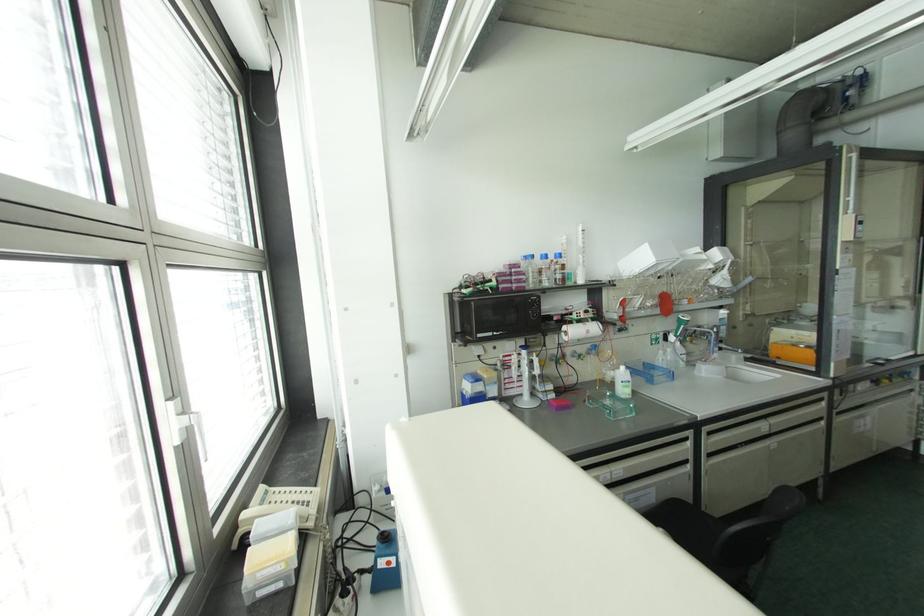
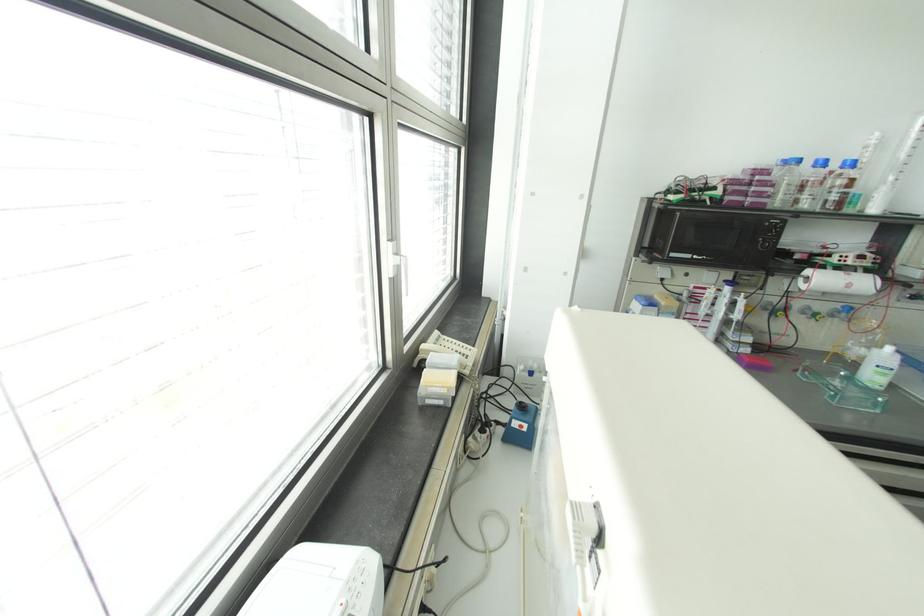
Based on the photo, first-person continuous shooting, in which direction is the camera rotating?

The camera rotated toward left-down.